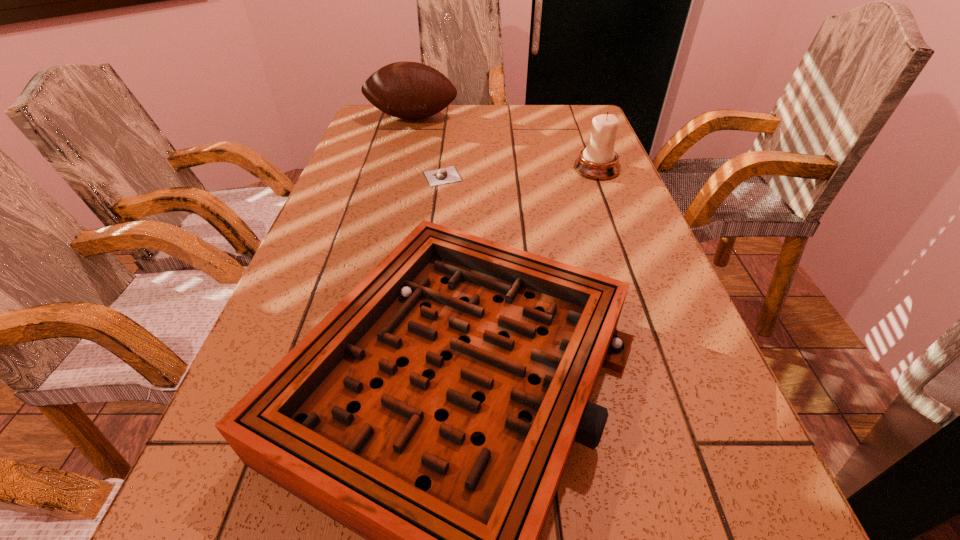
Find the location of `empty location between the garlic and the farthest object`. empty location between the garlic and the farthest object is located at coordinates (427, 147).

Point out which object is positioned as the third nearest to the candle holder. Please provide its 2D coordinates. Your answer should be formatted as a tuple, i.e. [(x, y)], where the tuple contains the x and y coordinates of a point satisfying the conditions above.

[(408, 90)]

You are a GUI agent. You are given a task and a screenshot of the screen. Output one action in this format:
    pyautogui.click(x=<x>, y=<y>)
    Task: Click on the object that stands as the closest to the nearest object
    
    Given the screenshot: What is the action you would take?
    pyautogui.click(x=447, y=175)

At what (x,y) coordinates should I click in order to perform the action: click on free space in the image that satisfies the following two spatial constraints: 1. on the laces of the candle holder; 2. on the right side of the farthest object. Please return your answer as a coordinate pair (x, y). This screenshot has width=960, height=540. Looking at the image, I should click on (398, 169).

Locate an element on the screen. vacant area in the image that satisfies the following two spatial constraints: 1. on the laces of the farthest object; 2. on the left side of the shortest object is located at coordinates (396, 177).

You are a GUI agent. You are given a task and a screenshot of the screen. Output one action in this format:
    pyautogui.click(x=<x>, y=<y>)
    Task: Click on the free space that satisfies the following two spatial constraints: 1. on the laces of the shortest object; 2. on the left side of the football
    The width and height of the screenshot is (960, 540).
    Given the screenshot: What is the action you would take?
    pyautogui.click(x=396, y=177)

Image resolution: width=960 pixels, height=540 pixels. Identify the location of vacant point that satisfies the following two spatial constraints: 1. on the laces of the football; 2. on the right side of the candle holder. (398, 169).

Where is `blank space that satisfies the following two spatial constraints: 1. on the back side of the garlic; 2. on the left side of the candle holder`? Image resolution: width=960 pixels, height=540 pixels. blank space that satisfies the following two spatial constraints: 1. on the back side of the garlic; 2. on the left side of the candle holder is located at coordinates pyautogui.click(x=444, y=169).

I want to click on vacant region that satisfies the following two spatial constraints: 1. on the laces of the farthest object; 2. on the left side of the shortest object, so click(396, 177).

This screenshot has width=960, height=540. I want to click on blank area in the image that satisfies the following two spatial constraints: 1. on the laces of the football; 2. on the right side of the candle holder, so click(x=398, y=169).